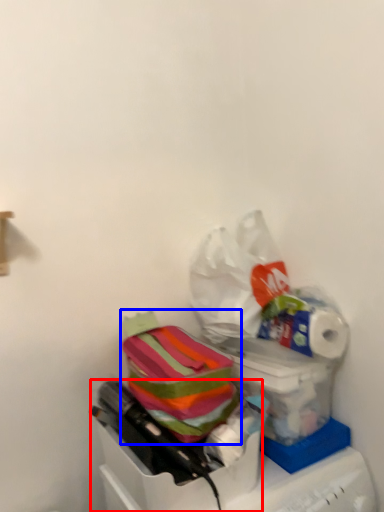
Question: Which object is closer to the camera taking this photo, box (highlighted by a red box) or material (highlighted by a blue box)?

Choices:
 (A) box
 (B) material

Answer: (A)